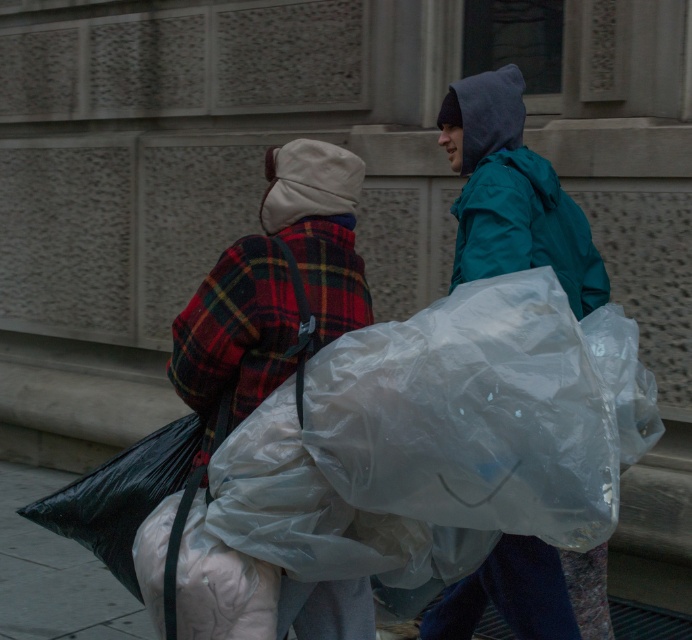
Question: Which object appears farthest from the camera in this image?

Choices:
 (A) transparent plastic bag at right
 (B) flannel plaid jacket at center

Answer: (A)

Question: Does flannel plaid jacket at center have a lesser width compared to transparent plastic bag at right?

Choices:
 (A) yes
 (B) no

Answer: (A)

Question: Which point appears closest to the camera in this image?

Choices:
 (A) (601, 547)
 (B) (307, 161)

Answer: (B)

Question: Is flannel plaid jacket at center closer to camera compared to transparent plastic bag at right?

Choices:
 (A) yes
 (B) no

Answer: (A)

Question: Is flannel plaid jacket at center positioned before transparent plastic bag at right?

Choices:
 (A) yes
 (B) no

Answer: (A)